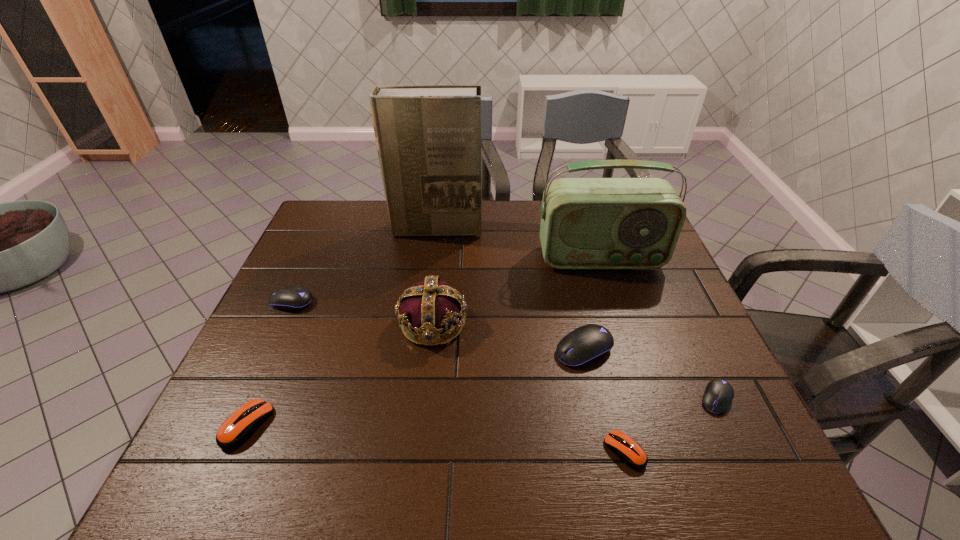
The width and height of the screenshot is (960, 540). I want to click on vacant space that satisfies the following two spatial constraints: 1. on the front side of the second black computer mouse from right to left; 2. on the right side of the nearest black computer mouse, so click(595, 399).